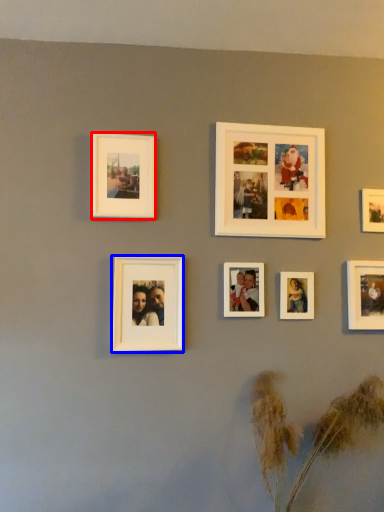
Question: Which object is closer to the camera taking this photo, picture frame (highlighted by a red box) or picture frame (highlighted by a blue box)?

Choices:
 (A) picture frame
 (B) picture frame

Answer: (B)